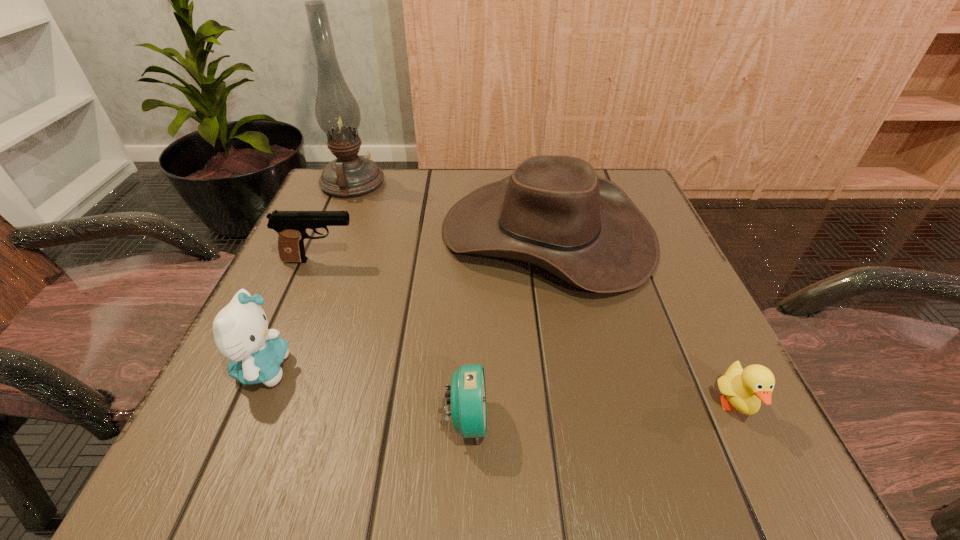
This screenshot has width=960, height=540. Find the location of `free space between the tallest object and the alarm clock`. free space between the tallest object and the alarm clock is located at coordinates (410, 302).

The width and height of the screenshot is (960, 540). What are the coordinates of `free area in between the kitten and the alarm clock` in the screenshot? It's located at (365, 394).

At what (x,y) coordinates should I click in order to perform the action: click on vacant space in between the cowboy hat and the duckling. Please return your answer as a coordinate pair (x, y). The image size is (960, 540). Looking at the image, I should click on (641, 320).

At what (x,y) coordinates should I click in order to perform the action: click on empty space that is in between the pistol and the kitten. Please return your answer as a coordinate pair (x, y). This screenshot has width=960, height=540. Looking at the image, I should click on [292, 314].

Find the location of a particular element. vacant area that lies between the duckling and the pistol is located at coordinates (528, 333).

I want to click on vacant region between the pistol and the duckling, so click(528, 333).

The width and height of the screenshot is (960, 540). What are the coordinates of `vacant area that lies between the duckling and the kitten` in the screenshot? It's located at (499, 387).

You are a GUI agent. You are given a task and a screenshot of the screen. Output one action in this format:
    pyautogui.click(x=<x>, y=<y>)
    Task: Click on the free space between the kitten and the cowboy hat
    The image size is (960, 540).
    Given the screenshot: What is the action you would take?
    pyautogui.click(x=405, y=301)

Select which object is the fifth closest to the oil lamp. Please provide its 2D coordinates. Your answer should be formatted as a tuple, i.e. [(x, y)], where the tuple contains the x and y coordinates of a point satisfying the conditions above.

[(745, 389)]

The width and height of the screenshot is (960, 540). I want to click on object that is the second closest to the cowboy hat, so click(x=291, y=226).